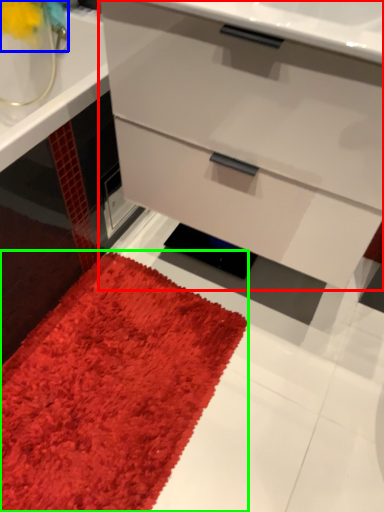
Question: Considering the real-world distances, which object is closest to chest of drawers (highlighted by a red box)? flower (highlighted by a blue box) or mat (highlighted by a green box).

Choices:
 (A) flower
 (B) mat

Answer: (B)